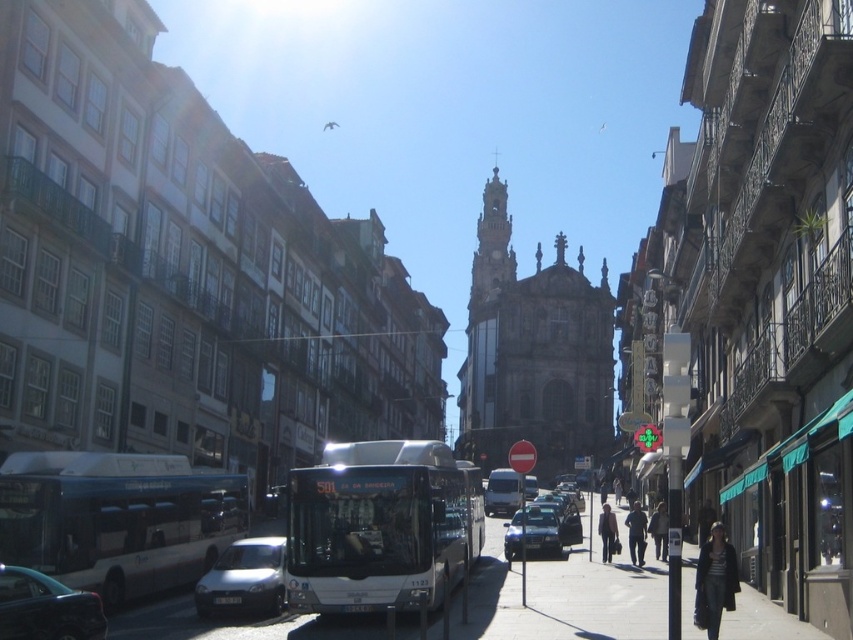
You are a delivery person who needs to deliver a package to the dark gray coat at center. You are currently standing next to the shiny black sedan at lower left. Can you walk directly to the coat without crossing any obstacles? The street is clear except for the buildings mentioned in the scene.

The shiny black sedan at lower left and dark gray coat at center are 42.40 meters apart. Since the street is clear except for the buildings mentioned, you can walk directly to the coat without crossing any obstacles.

You are a photographer standing in the middle of the street, and you want to capture both the dark gray coat at center and the dark blue jeans at center in your photo. Which object will appear taller in the final photograph?

The dark gray coat at center will appear taller in the final photograph because it is much taller than the dark blue jeans at center.

You are a fashion designer observing a pedestrian wearing a dark gray coat at center and dark blue jeans at center in an urban street scene. Which clothing item appears narrower when viewed from your perspective?

The dark gray coat at center has a lesser width compared to dark blue jeans at center, so the dark gray coat at center appears narrower.